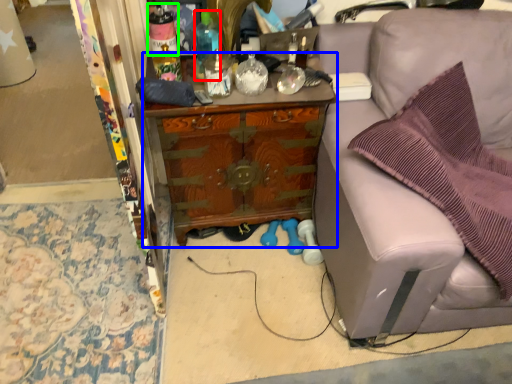
Question: Which is farther away from bottle (highlighted by a red box)? cabinetry (highlighted by a blue box) or bottle (highlighted by a green box)?

Choices:
 (A) cabinetry
 (B) bottle

Answer: (A)